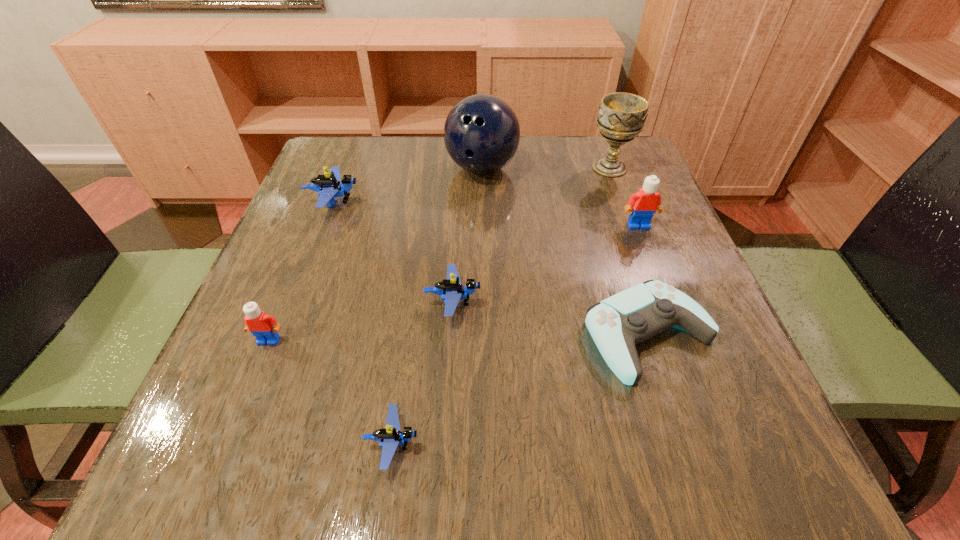
Where is `free spot at the far edge of the desktop`? This screenshot has width=960, height=540. free spot at the far edge of the desktop is located at coordinates (381, 185).

This screenshot has height=540, width=960. Find the location of `free space at the near edge`. free space at the near edge is located at coordinates (445, 434).

Image resolution: width=960 pixels, height=540 pixels. In the image, there is a desktop. What are the coordinates of `free space at the right edge` in the screenshot? It's located at (653, 255).

In the image, there is a desktop. At what (x,y) coordinates should I click in order to perform the action: click on vacant space at the near left corner. Please return your answer as a coordinate pair (x, y). Looking at the image, I should click on (290, 433).

Find the location of a particular element. This screenshot has width=960, height=540. free region at the far right corner of the desktop is located at coordinates (593, 170).

The image size is (960, 540). I want to click on free point between the control and the biggest blue Lego, so click(x=492, y=268).

Where is `vacant space that is in between the fourth tallest Lego and the blue bowling ball`? vacant space that is in between the fourth tallest Lego and the blue bowling ball is located at coordinates (468, 235).

Find the location of a particular element. Image resolution: width=960 pixels, height=540 pixels. empty space that is in between the blue bowling ball and the third tallest object is located at coordinates (560, 197).

Where is `vacant point located between the smallest blue Lego and the nearer white Lego`? vacant point located between the smallest blue Lego and the nearer white Lego is located at coordinates (330, 392).

Image resolution: width=960 pixels, height=540 pixels. I want to click on unoccupied area between the farthest blue Lego and the second nearest Lego, so click(x=301, y=271).